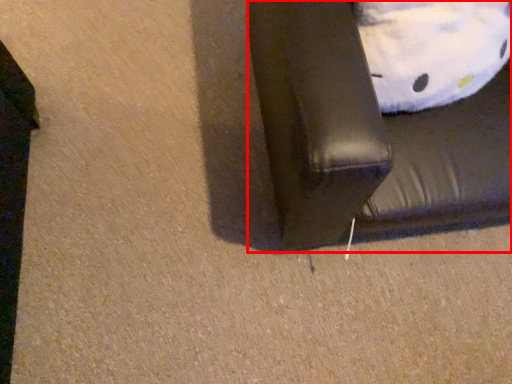
Question: In this image, where is furniture (annotated by the red box) located relative to pillow?

Choices:
 (A) left
 (B) right

Answer: (B)